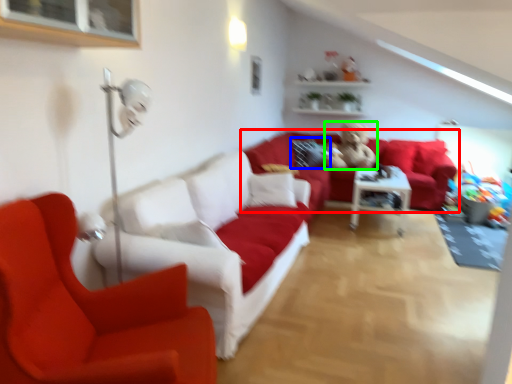
Question: Which object is the closest to the studio couch (highlighted by a red box)? Choose among these: pillow (highlighted by a blue box) or figurine (highlighted by a green box).

Choices:
 (A) pillow
 (B) figurine

Answer: (A)